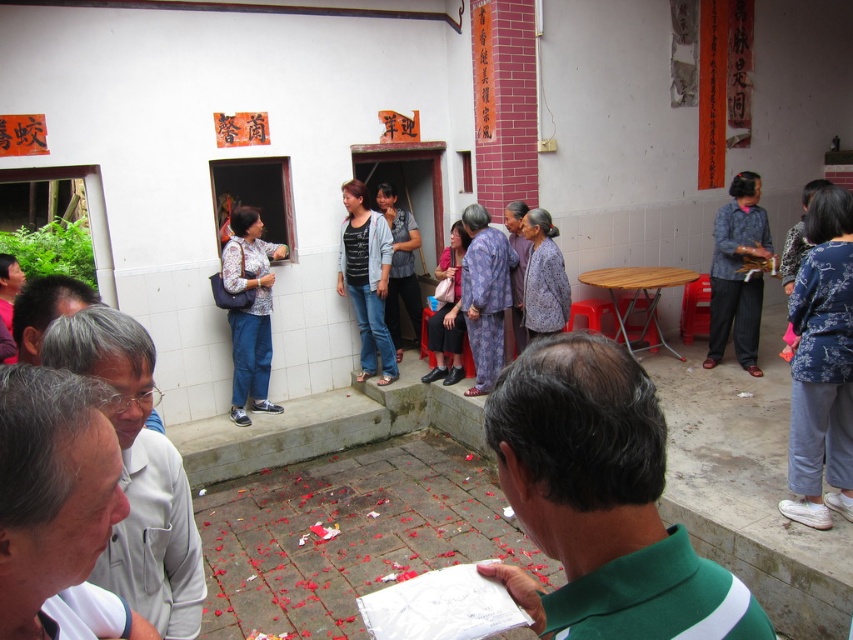
Is blue textured blouse at right closer to camera compared to gray matte glasses at lower left?

No, blue textured blouse at right is behind gray matte glasses at lower left.

What do you see at coordinates (737, 273) in the screenshot? This screenshot has height=640, width=853. I see `blue textured blouse at right` at bounding box center [737, 273].

Who is more forward, (x=734, y=227) or (x=91, y=294)?

Point (x=91, y=294)

You are a GUI agent. You are given a task and a screenshot of the screen. Output one action in this format:
    pyautogui.click(x=<x>, y=<y>)
    Task: Click on the blue textured blouse at right
    Image resolution: width=853 pixels, height=640 pixels.
    Given the screenshot: What is the action you would take?
    pyautogui.click(x=737, y=273)

Does green fabric shirt at center appear on the left side of printed fabric blouse at center?

In fact, green fabric shirt at center is to the right of printed fabric blouse at center.

Between green fabric shirt at center and printed fabric blouse at center, which one has less height?

With less height is green fabric shirt at center.

Which is behind, point (734, 620) or point (236, 330)?

Positioned behind is point (236, 330).

Where is `green fabric shirt at center`? Image resolution: width=853 pixels, height=640 pixels. green fabric shirt at center is located at coordinates (601, 502).

Does white matte shirt at lower left appear on the left side of purple printed dress at center?

Indeed, white matte shirt at lower left is positioned on the left side of purple printed dress at center.

This screenshot has height=640, width=853. I want to click on white matte shirt at lower left, so click(x=138, y=474).